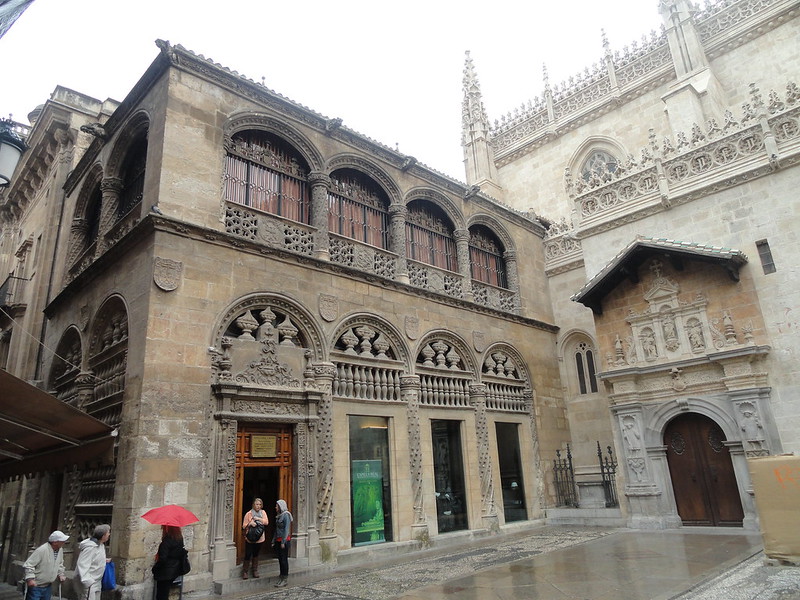
Find the location of `door`. door is located at coordinates (696, 490).